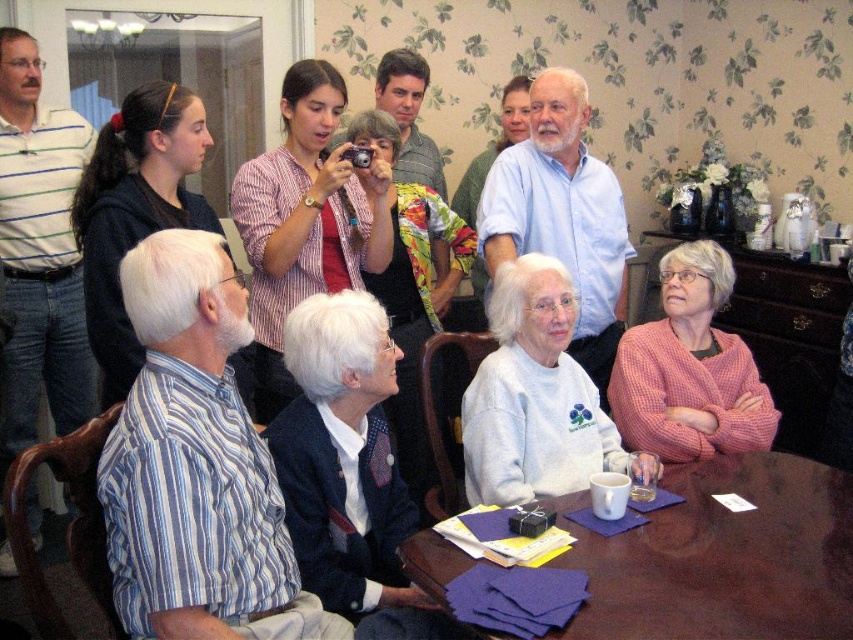
Question: Observing the image, what is the correct spatial positioning of black hoodie at upper left in reference to floral fabric jacket at center?

Choices:
 (A) right
 (B) left

Answer: (B)

Question: Among these points, which one is farthest from the camera?

Choices:
 (A) (775, 429)
 (B) (480, 276)

Answer: (B)

Question: Is black hoodie at upper left above floral fabric jacket at center?

Choices:
 (A) no
 (B) yes

Answer: (B)

Question: From the image, what is the correct spatial relationship of brown wooden table at lower center in relation to pink waffle knit sweater at lower right?

Choices:
 (A) right
 (B) left

Answer: (B)

Question: Among these objects, which one is nearest to the camera?

Choices:
 (A) white fleece sweater at center
 (B) striped shirt at upper center
 (C) matte blue sweater at center

Answer: (A)

Question: Which point is closer to the camera?

Choices:
 (A) 196,125
 (B) 418,465
 (C) 477,296

Answer: (A)